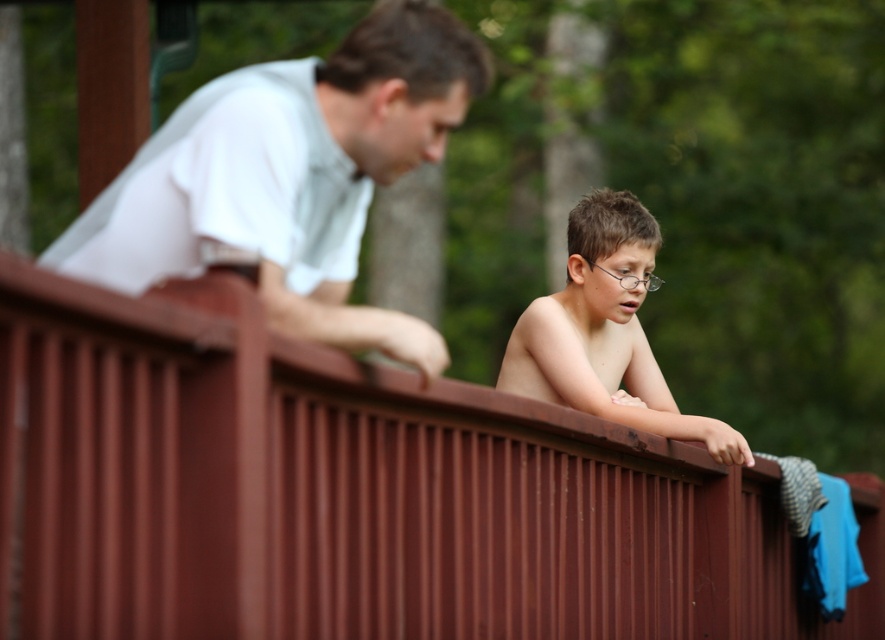
Question: Can you confirm if brown textured fence at upper center is positioned below white matte shirt at upper left?

Choices:
 (A) no
 (B) yes

Answer: (B)

Question: Among these objects, which one is farthest from the camera?

Choices:
 (A) shiny brown hair at center
 (B) white matte shirt at upper left

Answer: (A)

Question: Can you confirm if white matte shirt at upper left is wider than shiny brown hair at center?

Choices:
 (A) yes
 (B) no

Answer: (A)

Question: In this image, where is white matte shirt at upper left located relative to shiny brown hair at center?

Choices:
 (A) right
 (B) left

Answer: (B)

Question: Which of the following is the closest to the observer?

Choices:
 (A) (77, 483)
 (B) (314, 196)

Answer: (A)

Question: Considering the real-world distances, which object is closest to the white matte shirt at upper left?

Choices:
 (A) shiny brown hair at center
 (B) brown textured fence at upper center

Answer: (B)